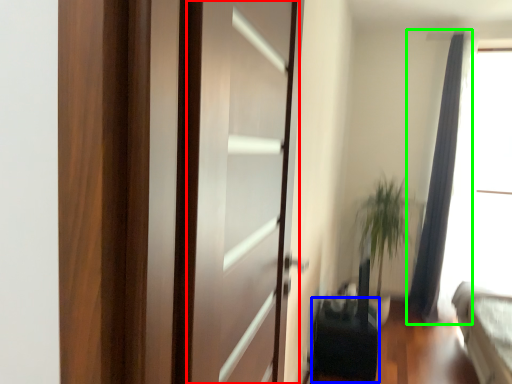
Question: Considering the real-world distances, which object is closest to screen door (highlighted by a red box)? furniture (highlighted by a blue box) or curtain (highlighted by a green box).

Choices:
 (A) furniture
 (B) curtain

Answer: (A)